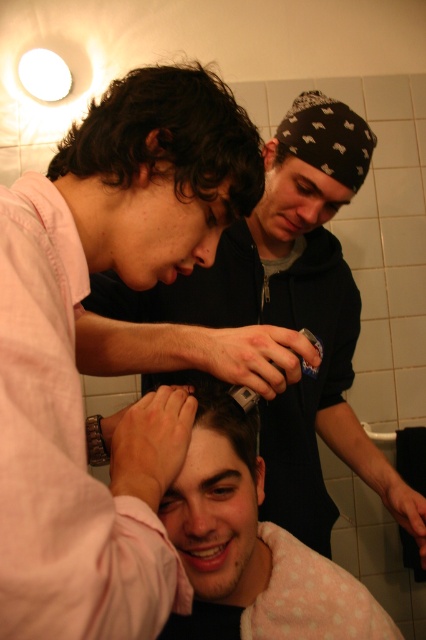
You are a hair stylist who needs to trim a client with a smooth skin head at center. You have a matte black hair clipper at center. Can you safely use the clipper to trim the hair without touching the skin?

The distance between the matte black hair clipper at center and the smooth skin head at center is 28.40 centimeters. Since the clipper is not in contact with the head, it can be safely used to trim the hair without touching the skin.

You are a hairstylist preparing to style the dark curly hair at center and the smooth skin head at center. Which of these two has a wider area to work with?

The dark curly hair at center has a larger width than the smooth skin head at center, so it provides a wider area to work with.

You are standing in the bathroom and want to take a photo of the point at coordinates (325, 508). The camera you have can focus on objects within 4 feet. Will the point be in focus?

The distance between the point at coordinates (325, 508) and the camera is 3.95 feet, which is within the camera focus range of 4 feet. Therefore, the point will be in focus.